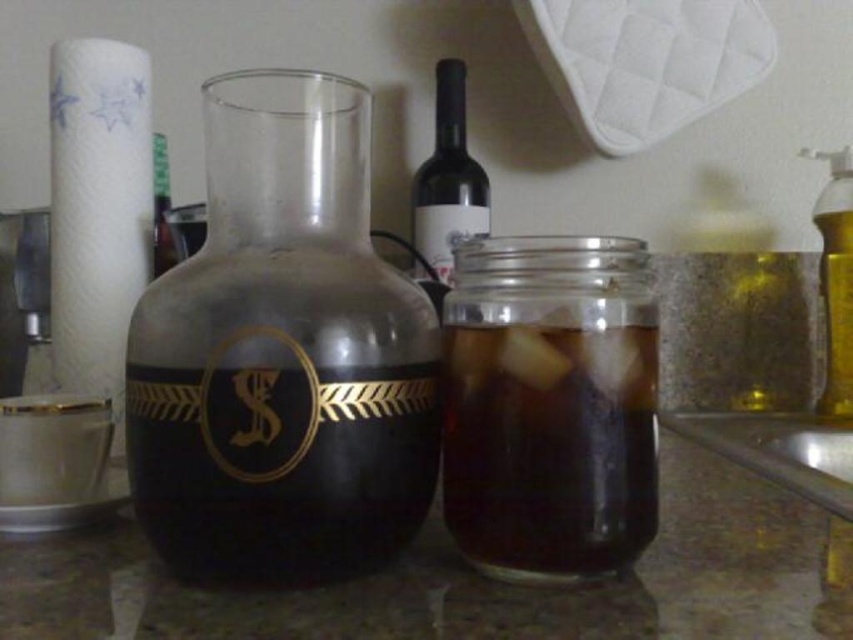
You need to place a 10 cm wide spice jar on the kitchen countertop. Given the transparent glass jar at center and the white paper towel at left, which object should you choose to place the spice jar next to for it to fit without overlapping?

The transparent glass jar at center has a lesser width compared to white paper towel at left, so placing the spice jar next to the transparent glass jar at center would provide enough space for it to fit without overlapping.

You are a barista preparing drinks and need to reach for the matte glass wine bottle at center. Can you easily access it without moving the transparent glass carafe at center?

The transparent glass carafe at center is closer to the viewer than the matte glass wine bottle at center, so you would need to move the carafe to access the wine bottle.

You are organizing items on a kitchen countertop and see the white paper towel at left and the matte glass wine bottle at center. Which item is positioned more to the left?

The white paper towel at left is positioned more to the left than the matte glass wine bottle at center.